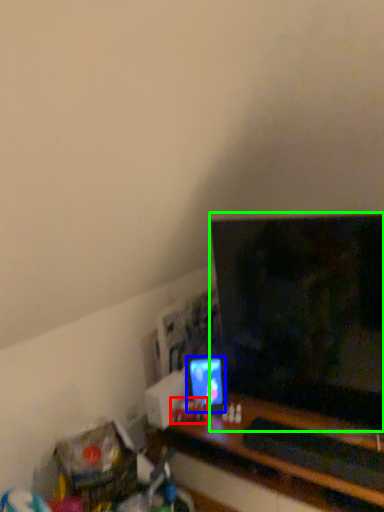
Question: Estimate the real-world distances between objects in this image. Which object is closer to toy (highlighted by a red box), computer monitor (highlighted by a blue box) or television (highlighted by a green box)?

Choices:
 (A) computer monitor
 (B) television

Answer: (A)